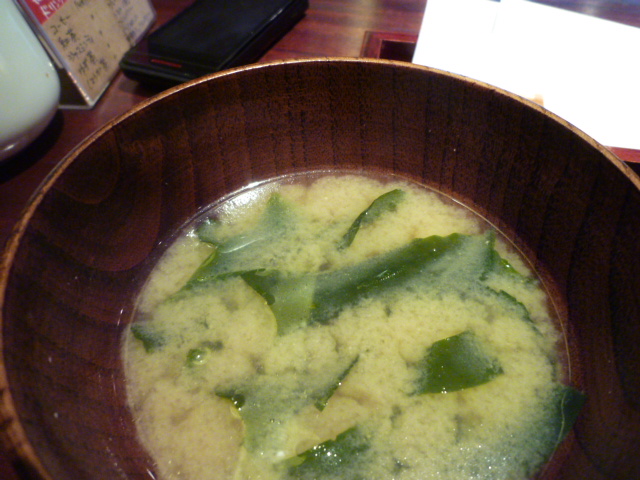
Image resolution: width=640 pixels, height=480 pixels. Find the location of `wood bowl`. wood bowl is located at coordinates (317, 143).